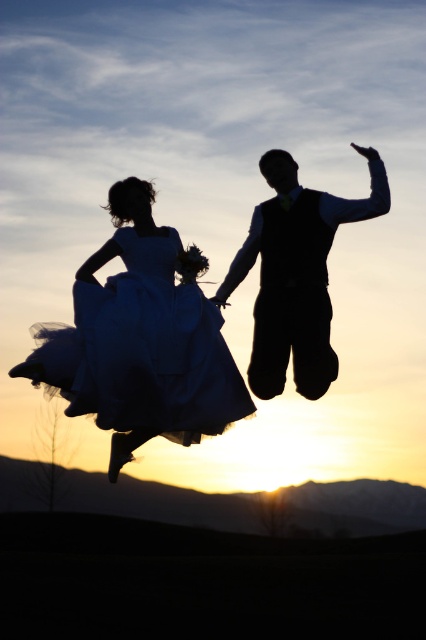
Can you confirm if white tulle dress at center is bigger than silhouette vest at center?

Yes.

The width and height of the screenshot is (426, 640). Describe the element at coordinates (143, 349) in the screenshot. I see `white tulle dress at center` at that location.

Where is `white tulle dress at center`? white tulle dress at center is located at coordinates coord(143,349).

Who is taller, blue tulle dress at center or white tulle dress at center?

blue tulle dress at center

Does blue tulle dress at center appear on the right side of white tulle dress at center?

Incorrect, blue tulle dress at center is not on the right side of white tulle dress at center.

The image size is (426, 640). Find the location of `blue tulle dress at center`. blue tulle dress at center is located at coordinates (198, 316).

Is blue tulle dress at center shorter than silhouette vest at center?

Incorrect, blue tulle dress at center's height does not fall short of silhouette vest at center's.

Does blue tulle dress at center have a greater width compared to silhouette vest at center?

Yes.

Identify the location of blue tulle dress at center. (198, 316).